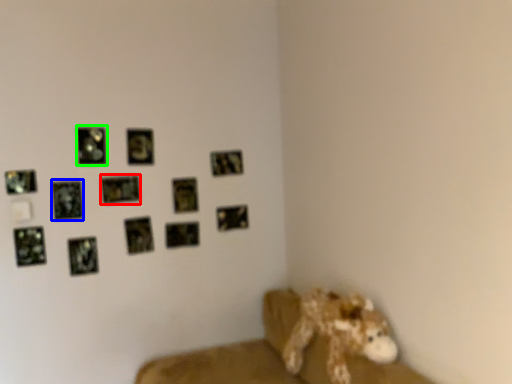
Question: Estimate the real-world distances between objects in this image. Which object is farther from picture frame (highlighted by a red box), picture frame (highlighted by a blue box) or picture frame (highlighted by a green box)?

Choices:
 (A) picture frame
 (B) picture frame

Answer: (A)